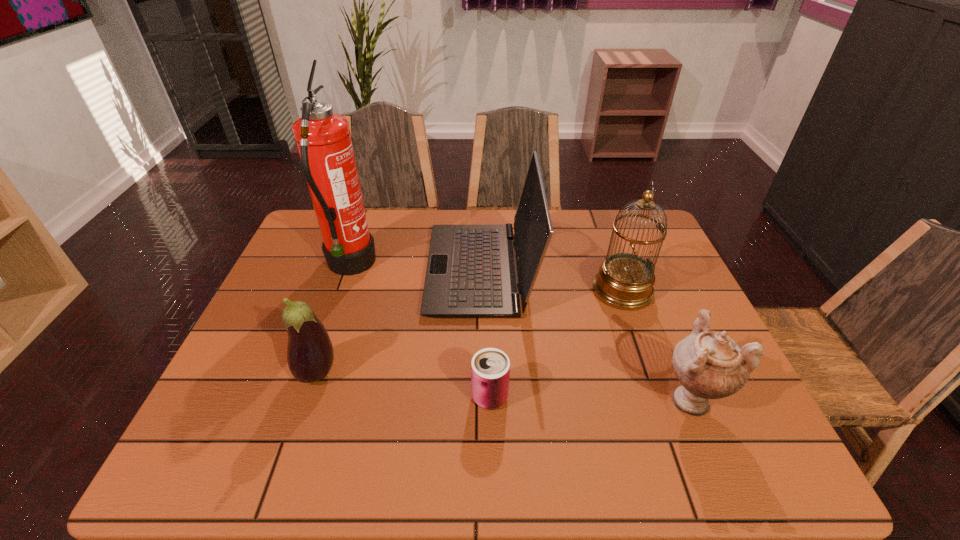
I want to click on birdcage present at the right edge, so click(x=625, y=281).

This screenshot has height=540, width=960. I want to click on urn present at the right edge, so click(x=709, y=365).

Locate an element on the screen. The width and height of the screenshot is (960, 540). object that is at the far left corner is located at coordinates (323, 139).

In the image, there is a desktop. At what (x,y) coordinates should I click in order to perform the action: click on vacant space at the far edge. Please return your answer as a coordinate pair (x, y). Image resolution: width=960 pixels, height=540 pixels. Looking at the image, I should click on (414, 210).

I want to click on vacant space at the near edge of the desktop, so click(x=592, y=444).

At what (x,y) coordinates should I click in order to perform the action: click on vacant space at the right edge of the desktop. Please return your answer as a coordinate pair (x, y). The height and width of the screenshot is (540, 960). Looking at the image, I should click on [673, 356].

The height and width of the screenshot is (540, 960). I want to click on free region at the near left corner of the desktop, so click(253, 433).

At what (x,y) coordinates should I click in order to perform the action: click on free space at the far right corner. Please return your answer as a coordinate pair (x, y). Looking at the image, I should click on (645, 232).

Where is `blank region between the laptop computer and the urn`? This screenshot has height=540, width=960. blank region between the laptop computer and the urn is located at coordinates (586, 333).

Image resolution: width=960 pixels, height=540 pixels. Identify the location of vacant point located between the can and the urn. (589, 397).